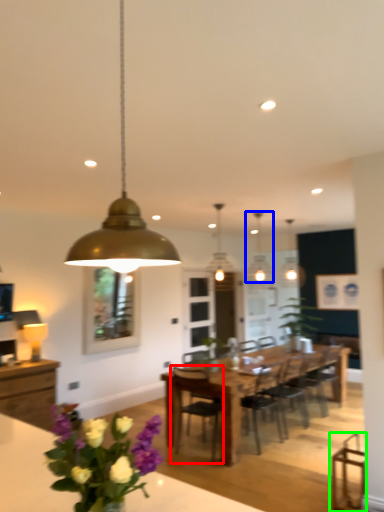
Question: Which object is positioned closest to chair (highlighted by a red box)? Select from lamp (highlighted by a blue box) and swivel chair (highlighted by a green box).

Choices:
 (A) lamp
 (B) swivel chair

Answer: (B)